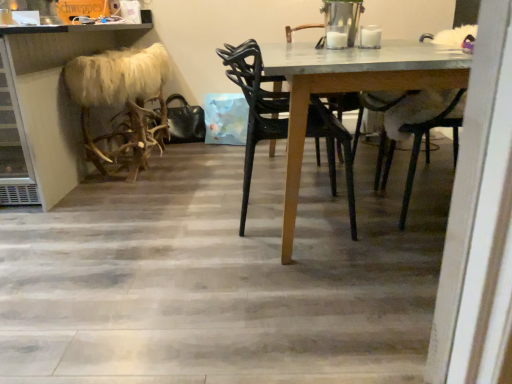
Locate an element on the screen. This screenshot has width=512, height=384. free spot in front of black plastic chair at center is located at coordinates (314, 273).